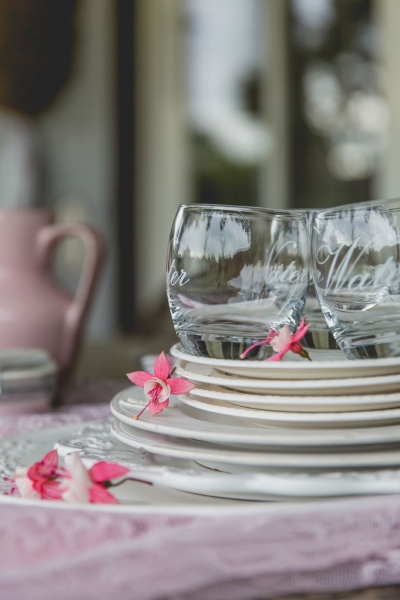
At what (x,y) coordinates should I click in order to perform the action: click on plates. Please return your answer as a coordinate pair (x, y). Looking at the image, I should click on (214, 459), (204, 433), (206, 409), (210, 396), (211, 379), (209, 361).